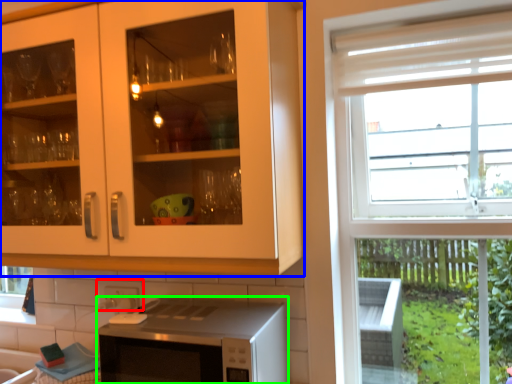
Question: Considering the real-world distances, which object is closest to tile (highlighted by a red box)? cabinetry (highlighted by a blue box) or microwave oven (highlighted by a green box).

Choices:
 (A) cabinetry
 (B) microwave oven

Answer: (B)